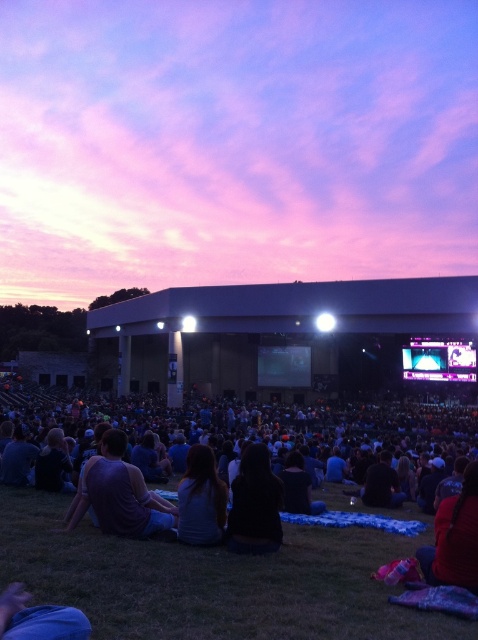
Does dark blue fabric at center lie behind black matte hair at center?

No, dark blue fabric at center is closer to the viewer.

Where is `dark blue fabric at center`? This screenshot has height=640, width=478. dark blue fabric at center is located at coordinates (276, 438).

Is point (166, 426) in front of point (249, 515)?

No, it is not.

This screenshot has height=640, width=478. In order to click on dark blue fabric at center in this screenshot , I will do coord(276,438).

Identify the location of silky brown hair at center. Image resolution: width=478 pixels, height=640 pixels. (201, 499).

Is silky brown hair at center to the left of matte black screen at center from the viewer's perspective?

Correct, you'll find silky brown hair at center to the left of matte black screen at center.

Which is behind, point (220, 497) or point (290, 355)?

Point (290, 355)

At what (x,y) coordinates should I click in order to perform the action: click on silky brown hair at center. Please return your answer as a coordinate pair (x, y). The height and width of the screenshot is (640, 478). Looking at the image, I should click on (201, 499).

Between purple matte tank top at lower left and black matte hair at center, which one has more height?

With more height is black matte hair at center.

Between purple matte tank top at lower left and black matte hair at center, which one is positioned lower?

purple matte tank top at lower left

Is point (166, 502) positioned behind point (243, 492)?

That is True.

The height and width of the screenshot is (640, 478). I want to click on purple matte tank top at lower left, so click(x=119, y=493).